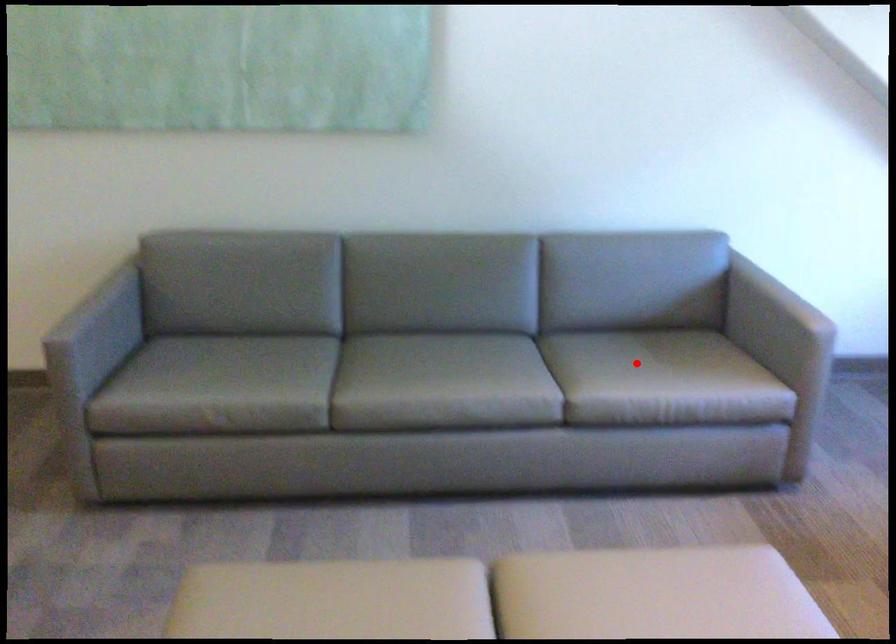
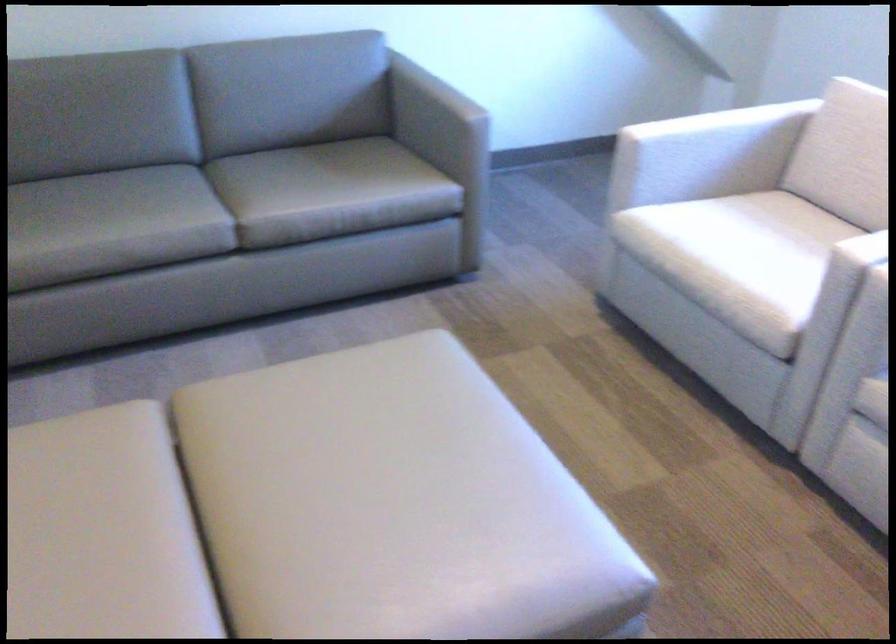
Where in the second image is the point corresponding to the highlighted location from the first image?

(306, 174)